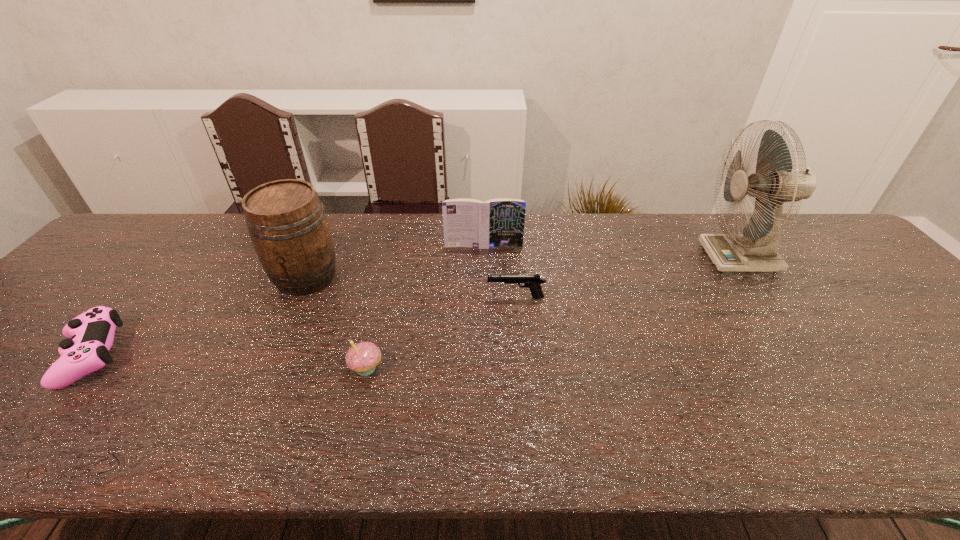
Where is `vacant space that's between the control and the rightmost object`? The width and height of the screenshot is (960, 540). vacant space that's between the control and the rightmost object is located at coordinates (414, 307).

At what (x,y) coordinates should I click in order to perform the action: click on free space that is in between the third shortest object and the leftmost object. Please return your answer as a coordinate pair (x, y). The image size is (960, 540). Looking at the image, I should click on (228, 362).

This screenshot has height=540, width=960. Identify the location of vacant space in between the cupcake and the rightmost object. (553, 313).

Locate an element on the screen. vacant area between the third shortest object and the leftmost object is located at coordinates (228, 362).

You are a GUI agent. You are given a task and a screenshot of the screen. Output one action in this format:
    pyautogui.click(x=<x>, y=<y>)
    Task: Click on the free space between the rightmost object and the gun
    
    Given the screenshot: What is the action you would take?
    pyautogui.click(x=628, y=278)

Where is `free spot between the rightmost object and the control`? The height and width of the screenshot is (540, 960). free spot between the rightmost object and the control is located at coordinates (414, 307).

The image size is (960, 540). Identify the location of empty location between the tallest object and the control. (414, 307).

Find the location of a particular element. object that is the fifth closest to the third shortest object is located at coordinates (775, 182).

At what (x,y) coordinates should I click in order to perform the action: click on object that is the third closest one to the rightmost object. Please return your answer as a coordinate pair (x, y). Looking at the image, I should click on tap(363, 358).

The image size is (960, 540). I want to click on vacant space that satisfies the following two spatial constraints: 1. at the aiming end of the gun; 2. on the front side of the control, so click(521, 356).